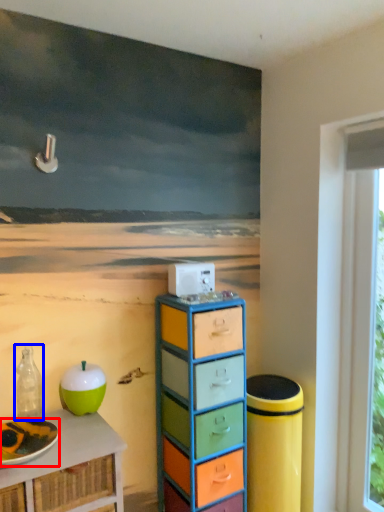
Question: Which object is closer to the camera taking this photo, plate (highlighted by a red box) or bottle (highlighted by a blue box)?

Choices:
 (A) plate
 (B) bottle

Answer: (A)